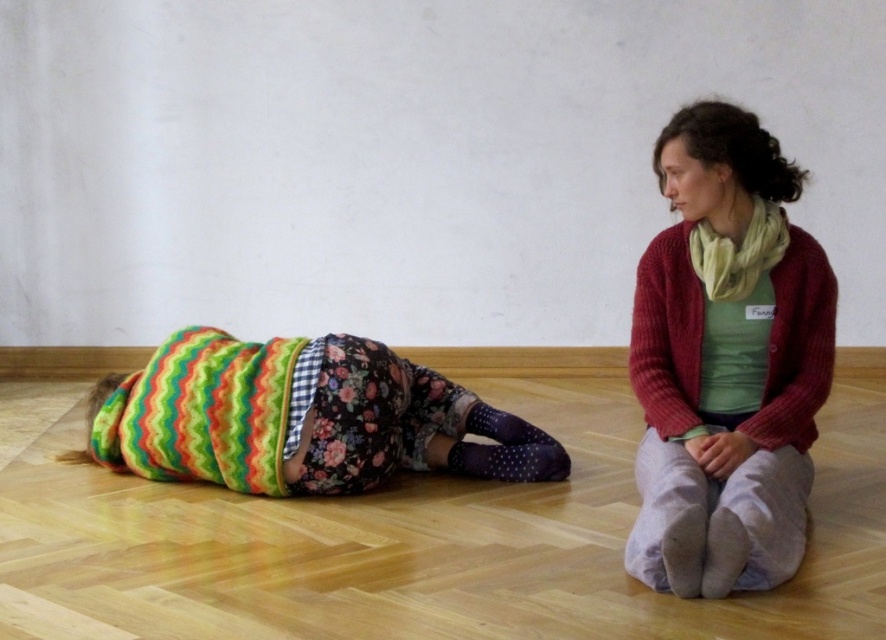
Between multicolored knitted blanket at lower left and knitted yellow scarf at upper right, which one has more height?

Standing taller between the two is multicolored knitted blanket at lower left.

Does point (346, 492) come behind point (689, 243)?

Yes, it is behind point (689, 243).

This screenshot has width=886, height=640. I want to click on multicolored knitted blanket at lower left, so click(x=302, y=419).

Between knitted red sweater at right and knitted yellow scarf at upper right, which one is positioned lower?

knitted red sweater at right is lower down.

Does knitted red sweater at right appear under knitted yellow scarf at upper right?

Yes.

Which is in front, point (797, 424) or point (729, 288)?

Point (797, 424) is more forward.

Locate an element on the screen. knitted red sweater at right is located at coordinates (797, 348).

Between point (643, 580) and point (682, 356), which one is positioned in front?

Point (643, 580) is in front.

Looking at this image, which is below, knitted red sweater at center or knitted red sweater at right?

Positioned lower is knitted red sweater at center.

Is point (814, 240) more distant than point (662, 266)?

No, (814, 240) is closer to viewer.

Locate an element on the screen. Image resolution: width=886 pixels, height=640 pixels. knitted red sweater at center is located at coordinates (727, 362).